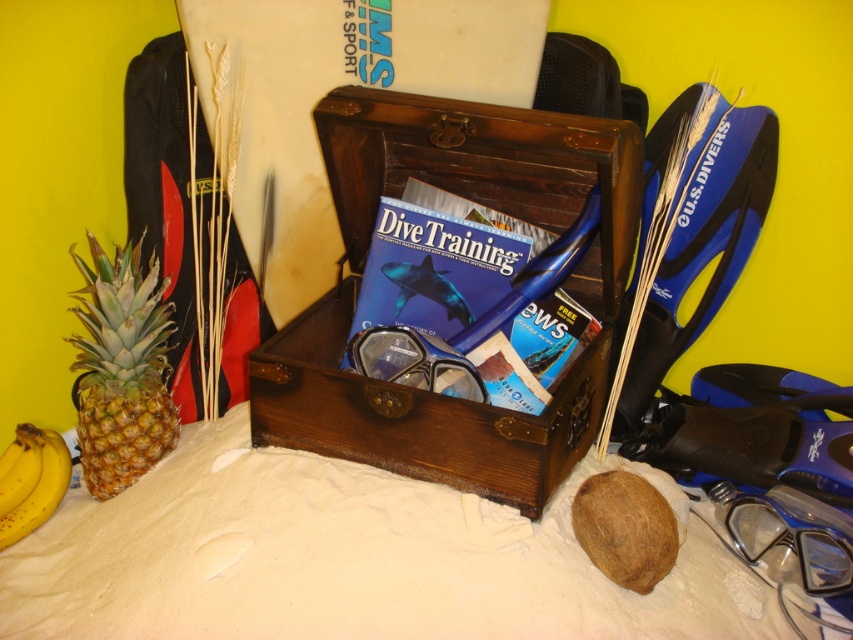
Question: Estimate the real-world distances between objects in this image. Which object is closer to the clear plastic goggles at center?

Choices:
 (A) yellow textured pineapple at left
 (B) transparent plastic goggles at lower right

Answer: (A)

Question: Does wooden chest at center come behind transparent plastic goggles at lower right?

Choices:
 (A) yes
 (B) no

Answer: (B)

Question: Which object is positioned closest to the transparent plastic goggles at lower right?

Choices:
 (A) clear plastic goggles at center
 (B) yellow textured pineapple at left

Answer: (A)

Question: Is yellow textured pineapple at left wider than yellow matte bananas at lower left?

Choices:
 (A) yes
 (B) no

Answer: (A)

Question: Which object is the farthest from the wooden chest at center?

Choices:
 (A) yellow matte bananas at lower left
 (B) clear plastic goggles at center
 (C) transparent plastic goggles at lower right
 (D) yellow textured pineapple at left

Answer: (A)

Question: Can you confirm if transparent plastic goggles at lower right is positioned to the left of yellow matte bananas at lower left?

Choices:
 (A) no
 (B) yes

Answer: (A)